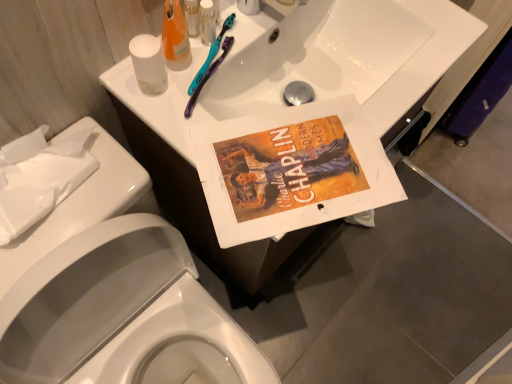
How much space does translucent plastic bottle at upper center, which is the first toiletry from left to right, occupy horizontally?

1.32 inches.

The height and width of the screenshot is (384, 512). Describe the element at coordinates (312, 63) in the screenshot. I see `white glossy sink at upper center` at that location.

I want to click on transparent plastic cup at upper left, so click(x=148, y=64).

Is translucent plastic bottle at upper center, which is the second toiletry from right to left, looking in the opposite direction of white glossy porcelain at upper center, which ranks as the 2th porcelain in back-to-front order?

That's not correct — translucent plastic bottle at upper center, which is the second toiletry from right to left, is not looking away from white glossy porcelain at upper center, which ranks as the 2th porcelain in back-to-front order.

In the scene shown: Is translucent plastic bottle at upper center, which is the second toiletry from right to left, next to white glossy porcelain at upper center, the first porcelain when ordered from front to back?

No, translucent plastic bottle at upper center, which is the second toiletry from right to left, is not with white glossy porcelain at upper center, the first porcelain when ordered from front to back.

Which of these two, translucent plastic bottle at upper center, which is the first toiletry from left to right, or white glossy porcelain at upper center, which ranks as the 2th porcelain in back-to-front order, is wider?

white glossy porcelain at upper center, which ranks as the 2th porcelain in back-to-front order, is wider.

Is white glossy sink at upper center spatially inside white glossy porcelain at upper center, the first porcelain when ordered from front to back, or outside of it?

The correct answer is: outside.

Consider the image. Does white glossy sink at upper center appear on the left side of white glossy porcelain at upper center, the first porcelain when ordered from front to back?

Incorrect, white glossy sink at upper center is not on the left side of white glossy porcelain at upper center, the first porcelain when ordered from front to back.

Consider the image. Between white glossy sink at upper center and white glossy porcelain at upper center, which ranks as the 2th porcelain in back-to-front order, which one has larger size?

Bigger between the two is white glossy porcelain at upper center, which ranks as the 2th porcelain in back-to-front order.

Could you tell me if white glossy sink at upper center is facing white glossy porcelain at upper center, which ranks as the 2th porcelain in back-to-front order?

No, white glossy sink at upper center is not aimed at white glossy porcelain at upper center, which ranks as the 2th porcelain in back-to-front order.

Which is nearer, [141,39] or [178,38]?

The point [141,39] is in front.

Is transparent plastic cup at upper left placed right next to translucent orange liquid at upper center?

Yes, the surface of transparent plastic cup at upper left is in contact with translucent orange liquid at upper center.

Could you tell me if transparent plastic cup at upper left is facing translucent orange liquid at upper center?

No.

Is transparent plastic cup at upper left bigger or smaller than translucent orange liquid at upper center?

transparent plastic cup at upper left is smaller than translucent orange liquid at upper center.

Considering the positions of objects transparent plastic cup at upper left and white paper towel at left, marked as the 2th porcelain in a front-to-back arrangement, in the image provided, who is more to the left, transparent plastic cup at upper left or white paper towel at left, marked as the 2th porcelain in a front-to-back arrangement,?

From the viewer's perspective, white paper towel at left, marked as the 2th porcelain in a front-to-back arrangement, appears more on the left side.

From the image's perspective, is transparent plastic cup at upper left on white paper towel at left, the 1th porcelain in the back-to-front sequence?

Correct, transparent plastic cup at upper left appears higher than white paper towel at left, the 1th porcelain in the back-to-front sequence, in the image.

Does point (158, 94) appear closer or farther from the camera than point (69, 231)?

Point (158, 94) is farther from the camera than point (69, 231).

Looking at this image, can you tell me how much transparent plastic cup at upper left and white paper towel at left, marked as the 2th porcelain in a front-to-back arrangement, differ in facing direction?

transparent plastic cup at upper left and white paper towel at left, marked as the 2th porcelain in a front-to-back arrangement, are facing 3.41 degrees away from each other.

What's the angular difference between clear plastic bottle at upper center, which ranks as the second toiletry in left-to-right order, and white paper towel at left, marked as the 2th porcelain in a front-to-back arrangement,'s facing directions?

The angular difference between clear plastic bottle at upper center, which ranks as the second toiletry in left-to-right order, and white paper towel at left, marked as the 2th porcelain in a front-to-back arrangement, is 2.81 degrees.

Is clear plastic bottle at upper center, placed as the 1th toiletry when sorted from right to left, in front of or behind white paper towel at left, marked as the 2th porcelain in a front-to-back arrangement, in the image?

clear plastic bottle at upper center, placed as the 1th toiletry when sorted from right to left, is behind white paper towel at left, marked as the 2th porcelain in a front-to-back arrangement.

Is clear plastic bottle at upper center, which ranks as the second toiletry in left-to-right order, positioned with its back to white paper towel at left, the 1th porcelain in the back-to-front sequence?

clear plastic bottle at upper center, which ranks as the second toiletry in left-to-right order, does not have its back to white paper towel at left, the 1th porcelain in the back-to-front sequence.

From a real-world perspective, is translucent orange liquid at upper center positioned under transparent plastic cup at upper left based on gravity?

No, from a real-world perspective, translucent orange liquid at upper center is not below transparent plastic cup at upper left.

Is translucent orange liquid at upper center surrounding transparent plastic cup at upper left?

Actually, transparent plastic cup at upper left is outside translucent orange liquid at upper center.

Is translucent orange liquid at upper center next to transparent plastic cup at upper left?

Yes, translucent orange liquid at upper center is in contact with transparent plastic cup at upper left.

Between white glossy sink at upper center and clear plastic bottle at upper center, which ranks as the second toiletry in left-to-right order, which one is positioned in front?

white glossy sink at upper center is closer to the camera.

Can you confirm if white glossy sink at upper center is positioned to the left of clear plastic bottle at upper center, which ranks as the second toiletry in left-to-right order?

No, white glossy sink at upper center is not to the left of clear plastic bottle at upper center, which ranks as the second toiletry in left-to-right order.

Is white glossy sink at upper center inside or outside of clear plastic bottle at upper center, placed as the 1th toiletry when sorted from right to left?

The correct answer is: outside.

Consider the image. Is white glossy sink at upper center next to clear plastic bottle at upper center, which ranks as the second toiletry in left-to-right order, and touching it?

No, white glossy sink at upper center is not touching clear plastic bottle at upper center, which ranks as the second toiletry in left-to-right order.

From a real-world perspective, which toiletry is the 2nd one above the white glossy porcelain at upper center, the first porcelain when ordered from front to back? Please provide its 2D coordinates.

[(192, 17)]

From the image's perspective, which porcelain is the 2nd one below the white glossy sink at upper center? Please provide its 2D coordinates.

[(111, 286)]

Considering their positions, is clear plastic bottle at upper center, which ranks as the second toiletry in left-to-right order, positioned closer to white glossy sink at upper center than translucent orange liquid at upper center?

clear plastic bottle at upper center, which ranks as the second toiletry in left-to-right order, is positioned closer to the anchor white glossy sink at upper center.

Which object lies further to the anchor point transparent plastic cup at upper left, clear plastic bottle at upper center, which ranks as the second toiletry in left-to-right order, or white glossy porcelain at upper center, which ranks as the 2th porcelain in back-to-front order?

white glossy porcelain at upper center, which ranks as the 2th porcelain in back-to-front order, is further to transparent plastic cup at upper left.

When comparing their distances from transparent plastic cup at upper left, does white paper towel at left, marked as the 2th porcelain in a front-to-back arrangement, or translucent plastic bottle at upper center, which is the first toiletry from left to right, seem closer?

translucent plastic bottle at upper center, which is the first toiletry from left to right, lies closer to transparent plastic cup at upper left than the other object.

Looking at the image, which one is located further to white paper towel at left, marked as the 2th porcelain in a front-to-back arrangement, transparent plastic cup at upper left or white glossy porcelain at upper center, which ranks as the 2th porcelain in back-to-front order?

white glossy porcelain at upper center, which ranks as the 2th porcelain in back-to-front order, lies further to white paper towel at left, marked as the 2th porcelain in a front-to-back arrangement, than the other object.

When comparing their distances from white glossy sink at upper center, does translucent plastic bottle at upper center, which is the first toiletry from left to right, or translucent orange liquid at upper center seem further?

translucent plastic bottle at upper center, which is the first toiletry from left to right, is positioned further to the anchor white glossy sink at upper center.

Estimate the real-world distances between objects in this image. Which object is further from white glossy sink at upper center, transparent plastic cup at upper left or white glossy porcelain at upper center, the first porcelain when ordered from front to back?

white glossy porcelain at upper center, the first porcelain when ordered from front to back, is positioned further to the anchor white glossy sink at upper center.

From the image, which object appears to be farther from translucent orange liquid at upper center, transparent plastic cup at upper left or white glossy sink at upper center?

white glossy sink at upper center.

Consider the image. Looking at the image, which one is located closer to translucent plastic bottle at upper center, which is the second toiletry from right to left, transparent plastic cup at upper left or white paper towel at left, the 1th porcelain in the back-to-front sequence?

transparent plastic cup at upper left is positioned closer to the anchor translucent plastic bottle at upper center, which is the second toiletry from right to left.

Where is `sink between translucent plastic bottle at upper center, which is the first toiletry from left to right, and white glossy porcelain at upper center, the first porcelain when ordered from front to back, from top to bottom`? sink between translucent plastic bottle at upper center, which is the first toiletry from left to right, and white glossy porcelain at upper center, the first porcelain when ordered from front to back, from top to bottom is located at coordinates (312, 63).

I want to click on toilet paper between translucent plastic bottle at upper center, which is the second toiletry from right to left, and white paper towel at left, marked as the 2th porcelain in a front-to-back arrangement, in the up-down direction, so click(x=148, y=64).

Locate an element on the screen. Image resolution: width=512 pixels, height=384 pixels. toiletry between translucent plastic bottle at upper center, which is the first toiletry from left to right, and white glossy sink at upper center from left to right is located at coordinates (207, 22).

Locate an element on the screen. toilet paper between translucent orange liquid at upper center and white paper towel at left, the 1th porcelain in the back-to-front sequence, vertically is located at coordinates (148, 64).